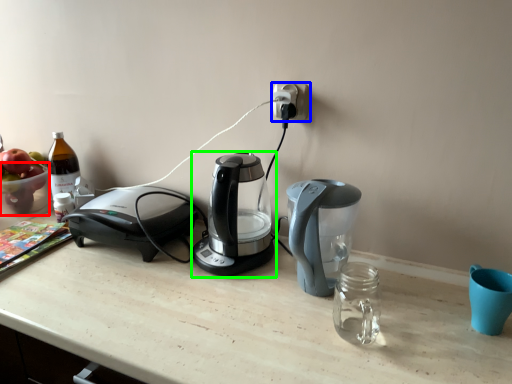
Question: Estimate the real-world distances between objects in this image. Which object is farther from bowl (highlighted by a red box), power plugs and sockets (highlighted by a blue box) or coffee maker (highlighted by a green box)?

Choices:
 (A) power plugs and sockets
 (B) coffee maker

Answer: (A)